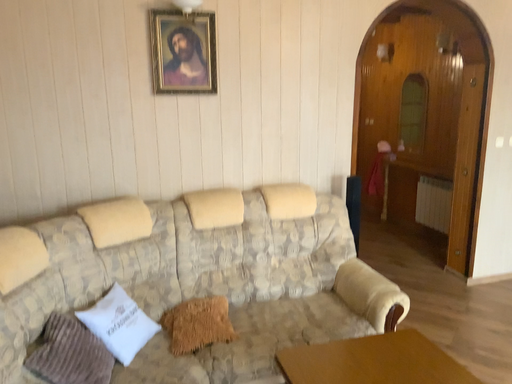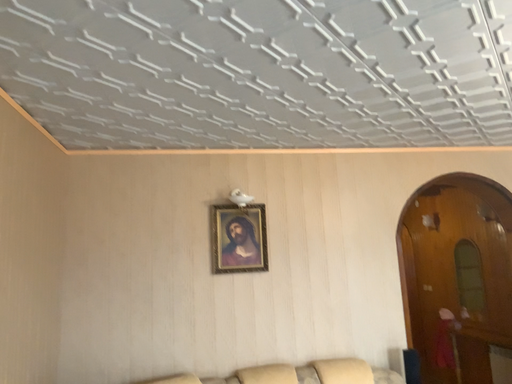
Question: How did the camera likely rotate when shooting the video?

Choices:
 (A) rotated upward
 (B) rotated downward

Answer: (A)